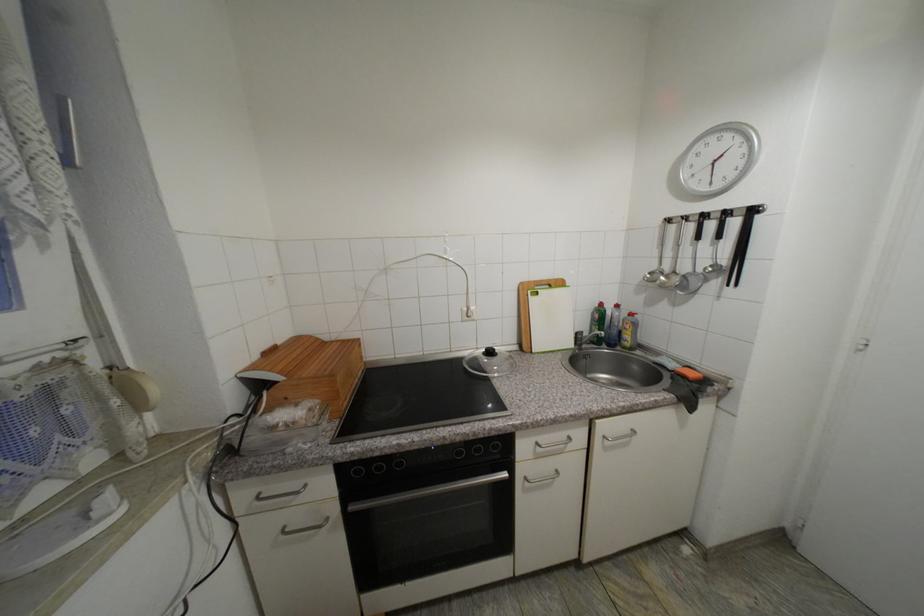
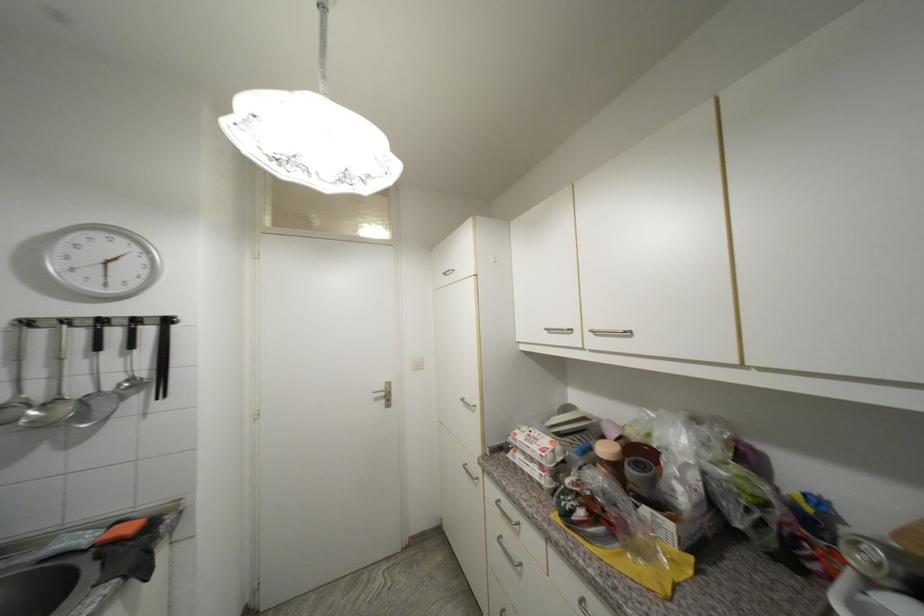
Locate, in the second image, the point that corresponds to (710,217) in the first image.

(108, 323)